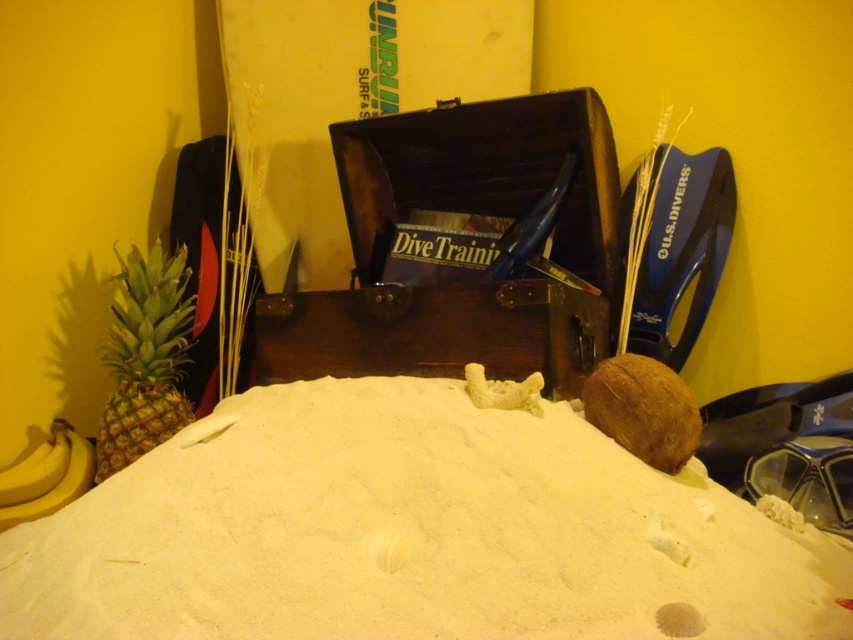
In the scene shown: You are planning to place a small decorative item on the table next to the wooden chest at center and the green textured pineapple at left. Which object should you choose to place the item on if you want it to be more stable?

The wooden chest at center has a larger width than the green textured pineapple at left, so placing the item on the wooden chest at center would provide a more stable surface.

You are standing at the point marked as point (410, 532) in the image. Looking around, you see white sand at center and a dark wooden chest labeled Dive Training in the background. What is directly beneath your feet?

The point (410, 532) is on white sand at center, so the area directly beneath your feet is the white sand at center.

You are organizing a beach party and need to place decorations. You have the wooden chest at center and the yellow matte bananas at lower left. Which object should you choose if you want to place a larger decoration in the middle of the sand?

The wooden chest at center is bigger than the yellow matte bananas at lower left, so you should choose the wooden chest at center for a larger decoration in the middle of the sand.